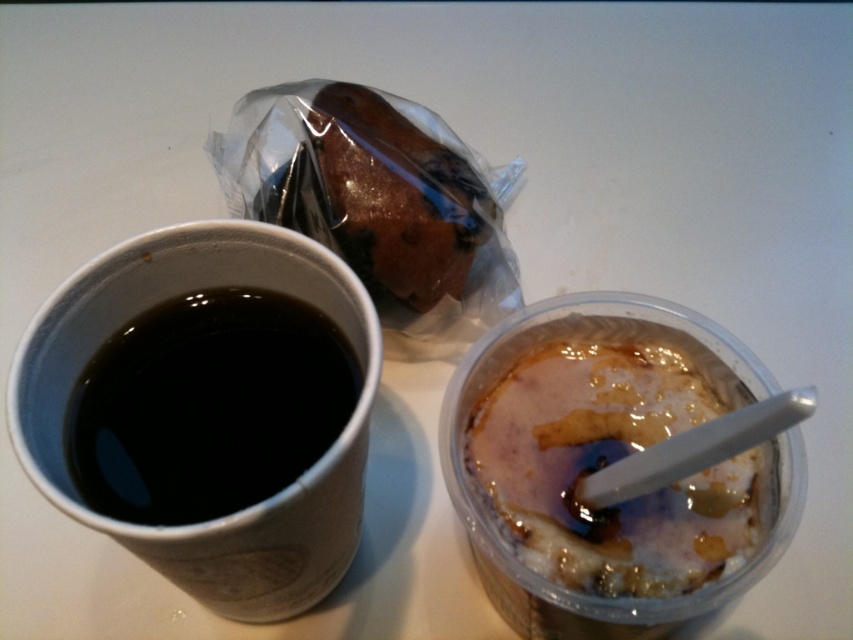
You are a barista who needs to place both the black paper cup at left and the black matte cup at left into a small rectangular box. The box can only accommodate items up to 12 cm in height. Which cup might not fit if the taller one is 14 cm tall?

The black paper cup at left is taller than the black matte cup at left. Since the taller cup is 14 cm, it exceeds the box height limit of 12 cm, so the black paper cup at left might not fit.

You are holding a smartphone that is 15 centimeters long. You want to take a photo of the black matte cup at left from your current position. Can your phone fit entirely in the frame if you focus on the cup?

The black matte cup at left is 54.16 centimeters away from viewer. Since the phone is 15 centimeters long, and the distance is greater than the phone length, the phone can fit in the frame when focusing on the cup.